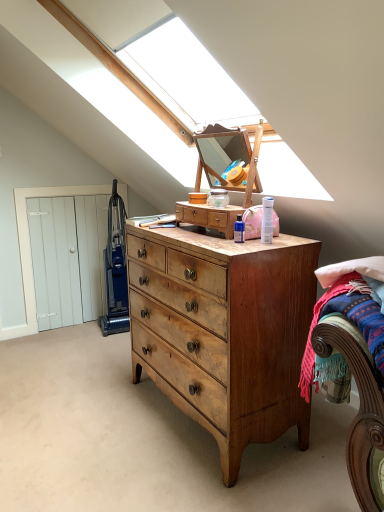
Question: Is blue plastic vacuum cleaner at left positioned in front of light brown wood dresser at center?

Choices:
 (A) yes
 (B) no

Answer: (B)

Question: Does blue plastic vacuum cleaner at left have a lesser height compared to light brown wood dresser at center?

Choices:
 (A) no
 (B) yes

Answer: (A)

Question: Can you confirm if blue plastic vacuum cleaner at left is thinner than light brown wood dresser at center?

Choices:
 (A) yes
 (B) no

Answer: (B)

Question: Does blue plastic vacuum cleaner at left appear on the left side of light brown wood dresser at center?

Choices:
 (A) no
 (B) yes

Answer: (B)

Question: From a real-world perspective, does blue plastic vacuum cleaner at left stand above light brown wood dresser at center?

Choices:
 (A) yes
 (B) no

Answer: (B)

Question: Is wooden bed at lower right to the left or to the right of light brown wood chest of drawers at center in the image?

Choices:
 (A) right
 (B) left

Answer: (A)

Question: From a real-world perspective, is wooden bed at lower right positioned above or below light brown wood chest of drawers at center?

Choices:
 (A) below
 (B) above

Answer: (B)

Question: Is point (322, 312) closer or farther from the camera than point (216, 434)?

Choices:
 (A) closer
 (B) farther

Answer: (A)

Question: From their relative heights in the image, would you say wooden bed at lower right is taller or shorter than light brown wood chest of drawers at center?

Choices:
 (A) short
 (B) tall

Answer: (A)

Question: Is light brown wood dresser at center bigger or smaller than light brown wood chest of drawers at center?

Choices:
 (A) big
 (B) small

Answer: (B)

Question: Which is correct: light brown wood dresser at center is inside light brown wood chest of drawers at center, or outside of it?

Choices:
 (A) outside
 (B) inside

Answer: (A)

Question: From the image's perspective, is light brown wood dresser at center above or below light brown wood chest of drawers at center?

Choices:
 (A) below
 (B) above

Answer: (B)

Question: Considering the positions of light brown wood dresser at center and light brown wood chest of drawers at center in the image, is light brown wood dresser at center taller or shorter than light brown wood chest of drawers at center?

Choices:
 (A) tall
 (B) short

Answer: (B)

Question: Is light brown wood dresser at center inside the boundaries of blue plastic vacuum cleaner at left, or outside?

Choices:
 (A) outside
 (B) inside

Answer: (A)

Question: Would you say light brown wood dresser at center is to the left or to the right of blue plastic vacuum cleaner at left in the picture?

Choices:
 (A) left
 (B) right

Answer: (B)